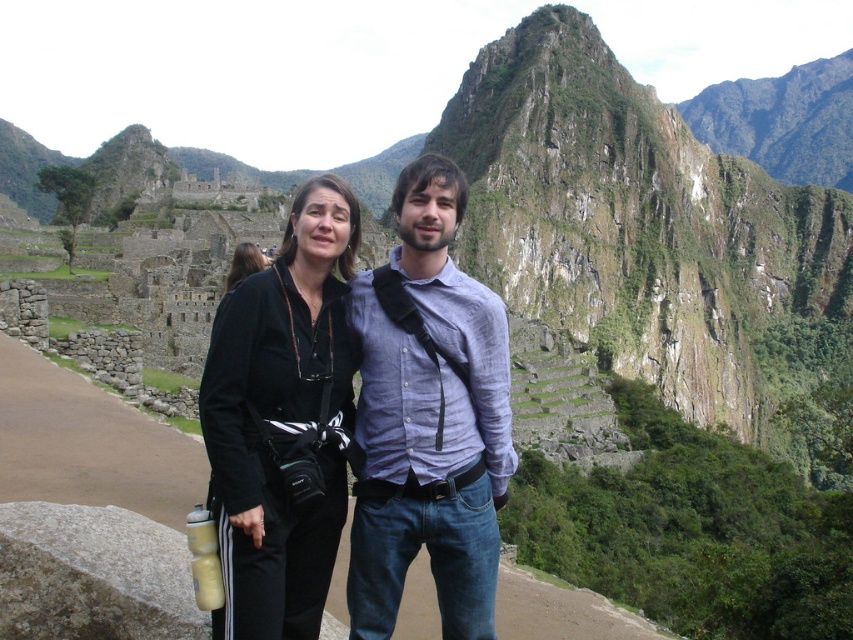
Question: Based on their relative distances, which object is farther from the black fabric jacket at center?

Choices:
 (A) light blue linen shirt at center
 (B) black fabric camera at center

Answer: (B)

Question: Is light blue linen shirt at center below black fabric camera at center?

Choices:
 (A) no
 (B) yes

Answer: (B)

Question: Considering the relative positions of black fabric jacket at center and black fabric camera at center in the image provided, where is black fabric jacket at center located with respect to black fabric camera at center?

Choices:
 (A) left
 (B) right

Answer: (B)

Question: Considering the real-world distances, which object is closest to the light blue linen shirt at center?

Choices:
 (A) black fabric camera at center
 (B) black fabric jacket at center

Answer: (B)

Question: Is black fabric jacket at center to the left of black fabric camera at center from the viewer's perspective?

Choices:
 (A) yes
 (B) no

Answer: (B)

Question: Which point appears closest to the camera in this image?

Choices:
 (A) click(x=225, y=285)
 (B) click(x=438, y=541)

Answer: (B)